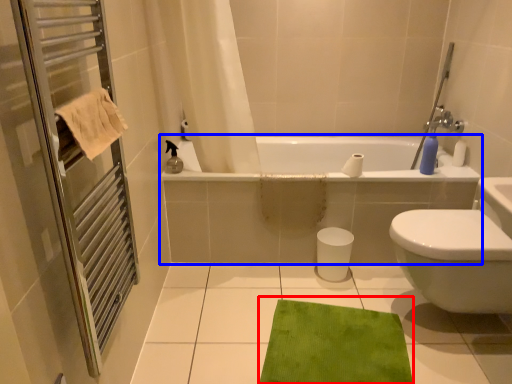
Question: Which of the following is the farthest to the observer, bath mat (highlighted by a red box) or bathtub (highlighted by a blue box)?

Choices:
 (A) bath mat
 (B) bathtub

Answer: (B)